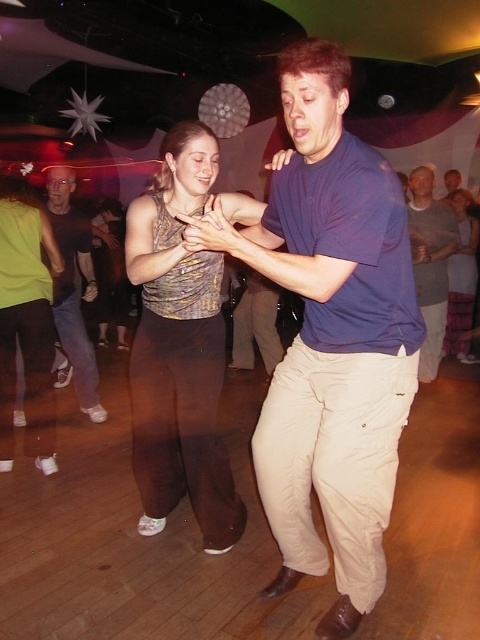
Question: Which point is closer to the camera taking this photo?

Choices:
 (A) (412, 216)
 (B) (100, 243)

Answer: (A)

Question: Is metallic silver blouse at center bigger than matte gold tank top at center?

Choices:
 (A) no
 (B) yes

Answer: (A)

Question: Which point appears farthest from the camera in this image?

Choices:
 (A) (260, 474)
 (B) (275, 294)
 (C) (96, 262)
 (D) (215, 456)

Answer: (C)

Question: Is blue cotton shirt at center thinner than khaki pants at center?

Choices:
 (A) no
 (B) yes

Answer: (A)

Question: Which point is closer to the camera taking this photo?

Choices:
 (A) (183, 440)
 (B) (230, 362)
 (C) (292, 432)
 (D) (83, 339)

Answer: (C)

Question: Where is matte black shirt at left located in relation to matte gold tank top at center in the image?

Choices:
 (A) above
 (B) below

Answer: (B)